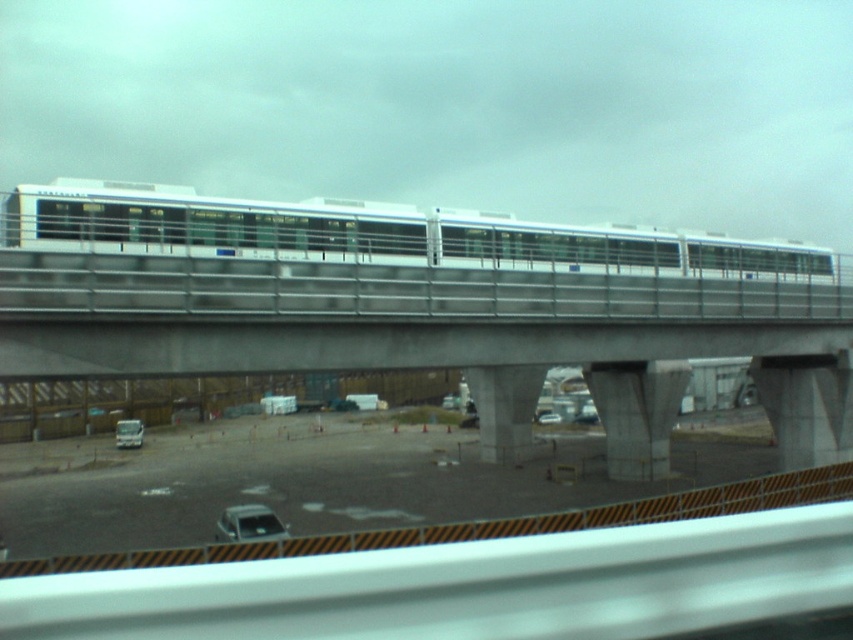
You are a drone operator trying to capture aerial footage of the elevated train bridge. You need to ensure that both the point at coordinates point [270,529] and point [119,445] are visible in your shot. Given that the camera can only focus on objects at a certain distance, which point should you prioritize to ensure it is in focus if you can only focus on one depth?

You should prioritize focusing on point [119,445] because it is further away from the camera compared to point [270,529], which is closer. Since the camera can only focus on one depth, prioritizing the further point ensures it remains in focus while the closer point may appear slightly blurred.

You are standing on the elevated train bridge and want to cross to the construction area below. The silver metallic car at lower center is blocking your path. Is it possible to walk around the car without stepping into the construction area?

The silver metallic car at lower center and viewer are 98.48 feet apart from each other, so you can walk around the car without entering the construction area as there is sufficient distance between you and the car.

Looking at this image, you are a pedestrian standing on the elevated train bridge and want to cross to the construction area below. You see the silver metallic car at lower center and the silver metallic van at lower left. Which vehicle is closer to your right side as you face the construction area?

The silver metallic car at lower center is to the right of the silver metallic van at lower left, so when facing the construction area, the silver metallic car at lower center would be closer to your right side.